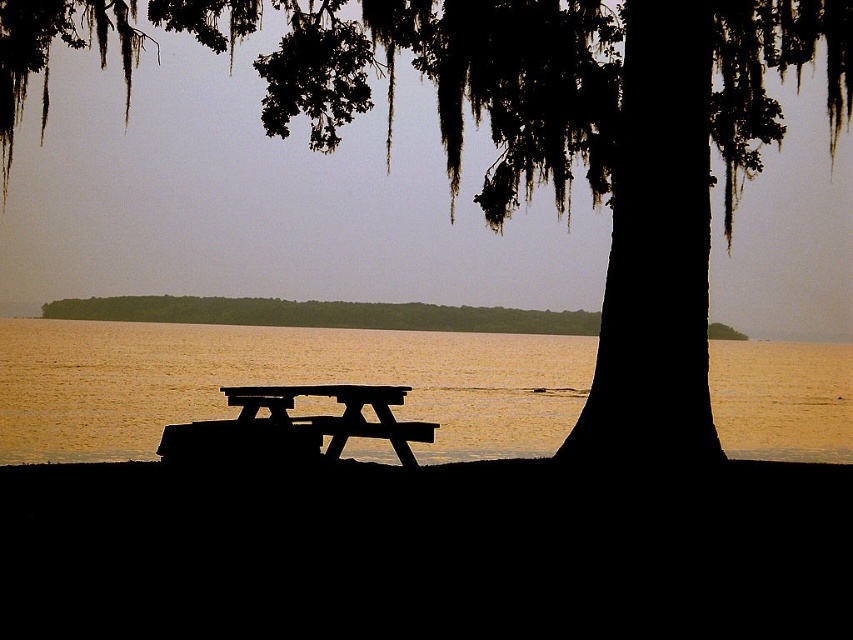
You are standing at the lakeside and want to sit down. You see the golden sand water at center and the black wood bench at center. Which one is closer to you?

The golden sand water at center is closer to you because it is in front of the black wood bench at center.

You are planning to take a photo of the silhouette bark tree at center and the black wood bench at center from a position where both are fully visible. Given their sizes, which object will appear bigger in the photo?

The silhouette bark tree at center will appear bigger in the photo since it has a larger size compared to the black wood bench at center.

You are planning to set up a tent for a lakeside camping trip. You have a tent that requires at least 3 meters of space. Looking at the image, can you determine if there is enough space between the silhouette bark tree at center and the golden sand water at center to set up your tent?

The silhouette bark tree at center is to the left of golden sand water at center. However, the distance between them is not specified in the provided information, so it is unclear if there is enough space for the tent.